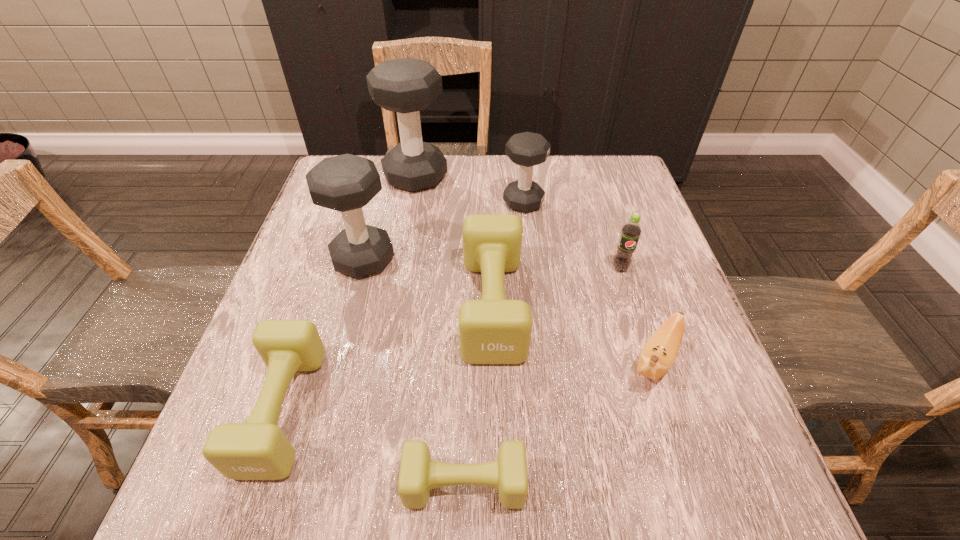
I want to click on yellow banana, so pos(658,355).

You are a GUI agent. You are given a task and a screenshot of the screen. Output one action in this format:
    pyautogui.click(x=<x>, y=<y>)
    Task: Click on the leftmost olive dumbbell
    This screenshot has height=540, width=960.
    Given the screenshot: What is the action you would take?
    pyautogui.click(x=258, y=449)

The image size is (960, 540). In order to click on the second shortest dumbbell in this screenshot , I will do `click(258, 449)`.

Where is `the smallest olive dumbbell`? The height and width of the screenshot is (540, 960). the smallest olive dumbbell is located at coordinates (418, 474).

What are the coordinates of `the shortest object` in the screenshot? It's located at (418, 474).

The image size is (960, 540). In order to click on blank area located on the right of the tallest dumbbell in this screenshot , I will do `click(578, 177)`.

Identify the location of free location located on the back of the fifth shortest dumbbell. (385, 180).

Identify the location of vacant space located on the left of the rightmost gray dumbbell. The height and width of the screenshot is (540, 960). (405, 202).

You are a GUI agent. You are given a task and a screenshot of the screen. Output one action in this format:
    pyautogui.click(x=<x>, y=<y>)
    Task: Click on the vacant space situated 0.330m on the front label of the soda
    Image resolution: width=960 pixels, height=540 pixels.
    Given the screenshot: What is the action you would take?
    pyautogui.click(x=665, y=412)

The width and height of the screenshot is (960, 540). I want to click on vacant space located 0.390m on the left of the biggest olive dumbbell, so click(276, 305).